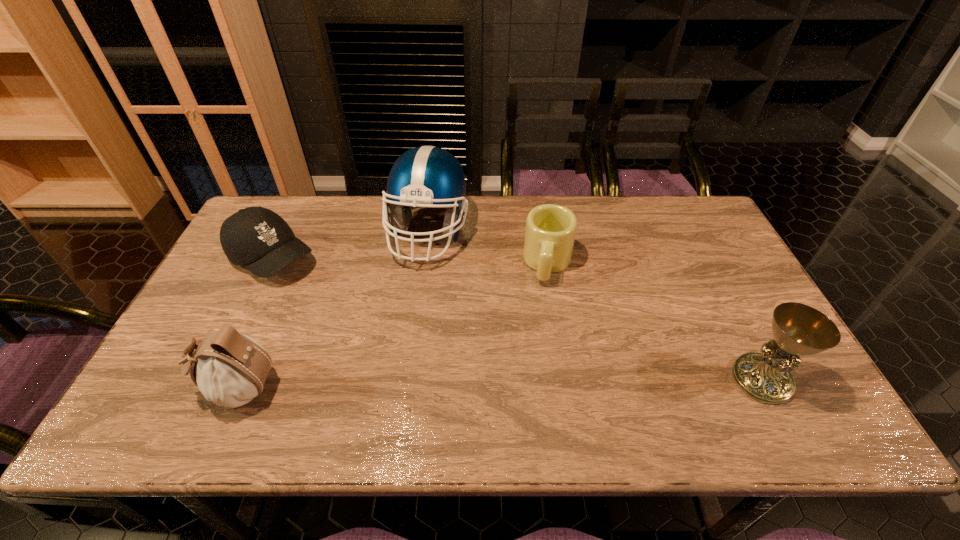
I want to click on vacant area that lies between the chalice and the pouch, so click(499, 383).

The width and height of the screenshot is (960, 540). What are the coordinates of `empty location between the pouch and the second object from right to left` in the screenshot? It's located at (393, 326).

I want to click on object that is the closest to the chalice, so click(x=550, y=232).

Select which object appears as the closest to the chalice. Please provide its 2D coordinates. Your answer should be formatted as a tuple, i.e. [(x, y)], where the tuple contains the x and y coordinates of a point satisfying the conditions above.

[(550, 232)]

At what (x,y) coordinates should I click in order to perform the action: click on vacant area in the image that satisfies the following two spatial constraints: 1. on the front side of the pouch; 2. on the front-facing side of the baseball cap. Please return your answer as a coordinate pair (x, y). The width and height of the screenshot is (960, 540). Looking at the image, I should click on (208, 388).

At what (x,y) coordinates should I click in order to perform the action: click on vacant space that satisfies the following two spatial constraints: 1. on the front side of the chalice; 2. on the left side of the baseball cap. Please return your answer as a coordinate pair (x, y). The width and height of the screenshot is (960, 540). Looking at the image, I should click on (212, 379).